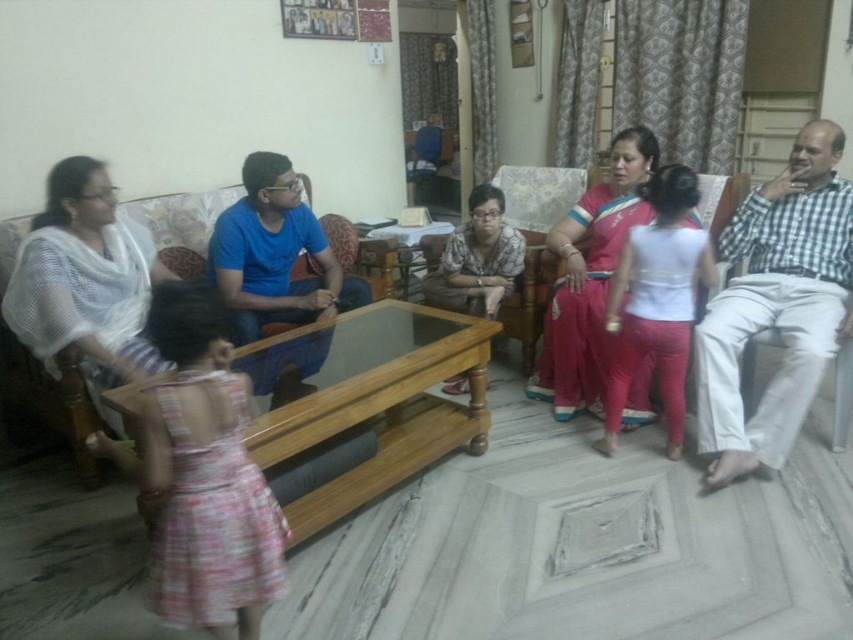
You are organizing a photoshoot in the living room and need to decide where to place a large backdrop. The backdrop requires a space larger than the white sheer fabric at left. Is there enough space near the matte floral dress at center for the backdrop?

The white sheer fabric at left is larger than the matte floral dress at center. Since the backdrop needs a space larger than the white sheer fabric at left, there isn for the backdrop near the matte floral dress at center.

You are a photographer standing at the camera position. You want to adjust the lighting by moving the white sheer fabric at left closer to the camera. How much distance do you need to cover to bring it to the camera?

The white sheer fabric at left is 7.45 feet away from the camera, so you need to move it 7.45 feet closer to the camera to adjust the lighting.

You are standing in the living room and want to find the white cotton blouse at center. Based on the coordinates provided, where should you look relative to the room?

The white cotton blouse at center is located at coordinates approximately 47.2 percent from the left edge and 77.1 percent from the top edge of the room.